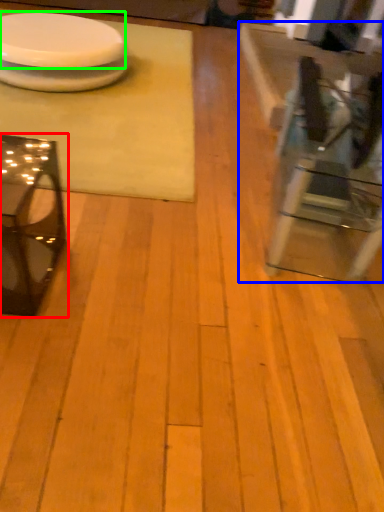
Question: Which object is positioned closest to table (highlighted by a red box)? Select from table (highlighted by a blue box) and platter (highlighted by a green box).

Choices:
 (A) table
 (B) platter

Answer: (A)